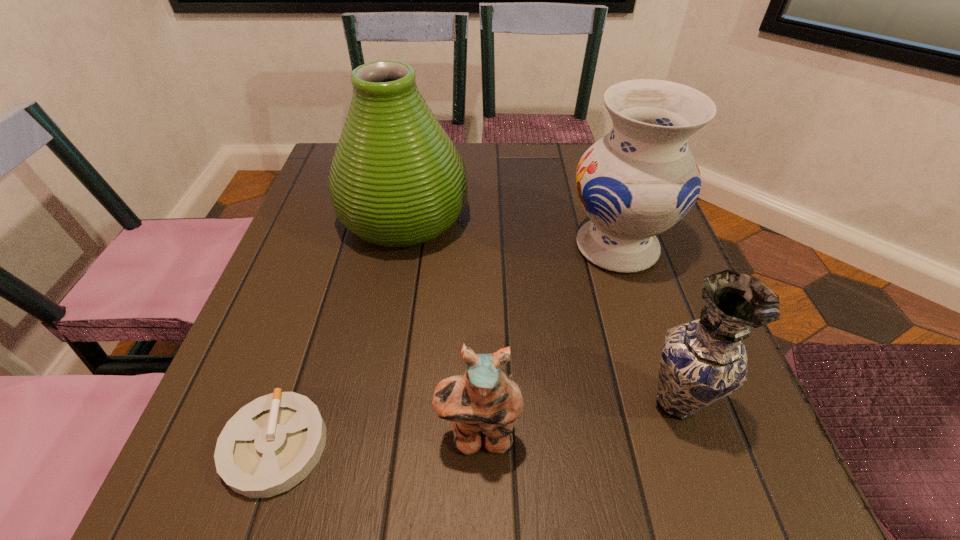
The height and width of the screenshot is (540, 960). Identify the location of the leftmost vase. (397, 180).

Where is `the nearest vase`? The image size is (960, 540). the nearest vase is located at coordinates (702, 361).

Find the location of a particular element. figurine is located at coordinates (485, 399).

Locate an element on the screen. ashtray is located at coordinates (271, 444).

What are the coordinates of `blank space located 0.260m on the right of the leftmost vase` in the screenshot? It's located at (586, 218).

You are a GUI agent. You are given a task and a screenshot of the screen. Output one action in this format:
    pyautogui.click(x=<x>, y=<y>)
    Task: Click on the vacant area located 0.070m on the left of the shortest vase
    The width and height of the screenshot is (960, 540).
    Given the screenshot: What is the action you would take?
    pyautogui.click(x=593, y=402)

At what (x,y) coordinates should I click in order to perform the action: click on free spot located 0.080m on the right of the ashtray. Please return your answer as a coordinate pair (x, y). The width and height of the screenshot is (960, 540). Looking at the image, I should click on (382, 446).

Identify the location of object that is at the far edge. The height and width of the screenshot is (540, 960). (397, 180).

This screenshot has height=540, width=960. Find the location of `figurine positioned at the near edge`. figurine positioned at the near edge is located at coordinates (485, 399).

The height and width of the screenshot is (540, 960). Identify the location of ashtray at the near edge. (271, 444).